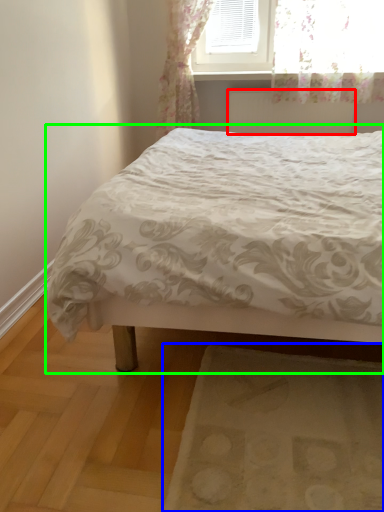
Question: Estimate the real-world distances between objects in this image. Which object is farther from radiator (highlighted by a red box), mat (highlighted by a blue box) or bed (highlighted by a green box)?

Choices:
 (A) mat
 (B) bed

Answer: (A)